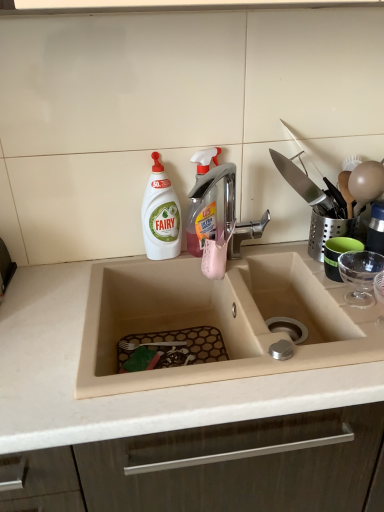
This screenshot has height=512, width=384. Identify the location of free space to the left of white plastic bottle at upper left, positioned as the first cleaning product in left-to-right order. (116, 263).